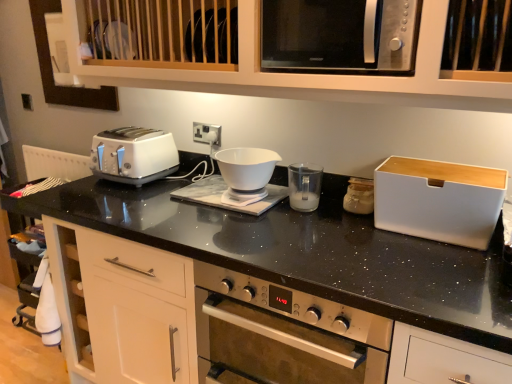
In order to click on free space above white glossy coffee machine at center (from a real-world perspective) in this screenshot , I will do `click(228, 188)`.